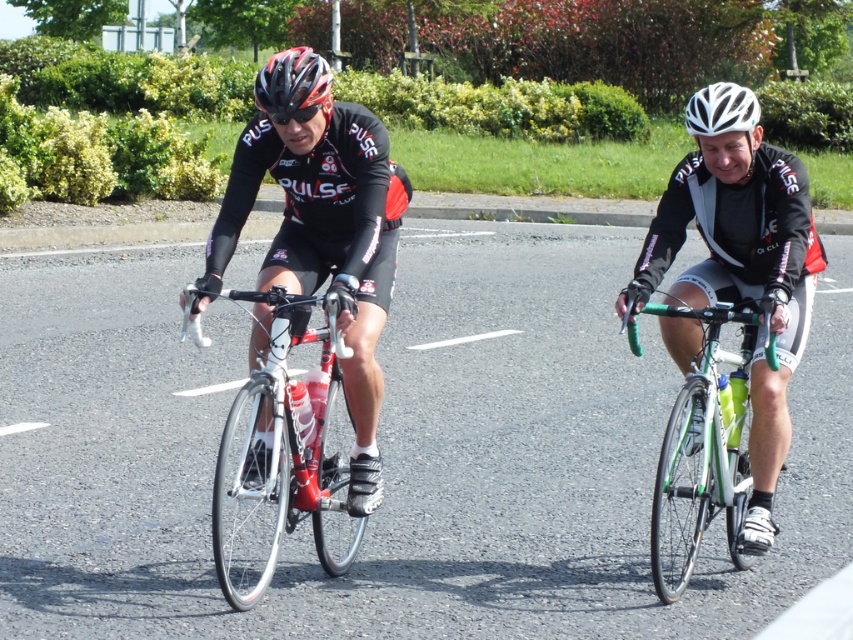
Based on the photo, you are a drone operator trying to capture a closeup shot of the white matte bicycle helmet at upper center. Your drone is currently hovering above the shiny metallic bicycle at center. Can your drone move directly towards the helmet without any obstacles in between? Please consider the distance between them.

The distance between the shiny metallic bicycle at center and the white matte bicycle helmet at upper center is 2.74 meters. Since there are no obstacles mentioned in the scene, the drone can move directly towards the helmet.

You are a spectator at a cycling event and want to take a photo of both the matte black helmet at center and the white matte bicycle helmet at upper center. Which helmet will appear larger in your photo?

The matte black helmet at center appears larger in the photo because it is closer to the viewer compared to the white matte bicycle helmet at upper center.